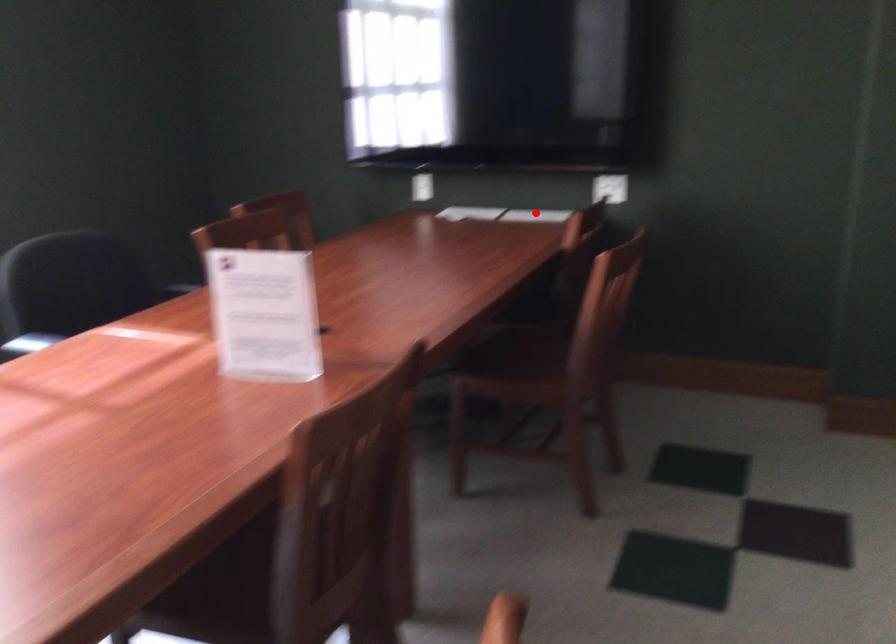
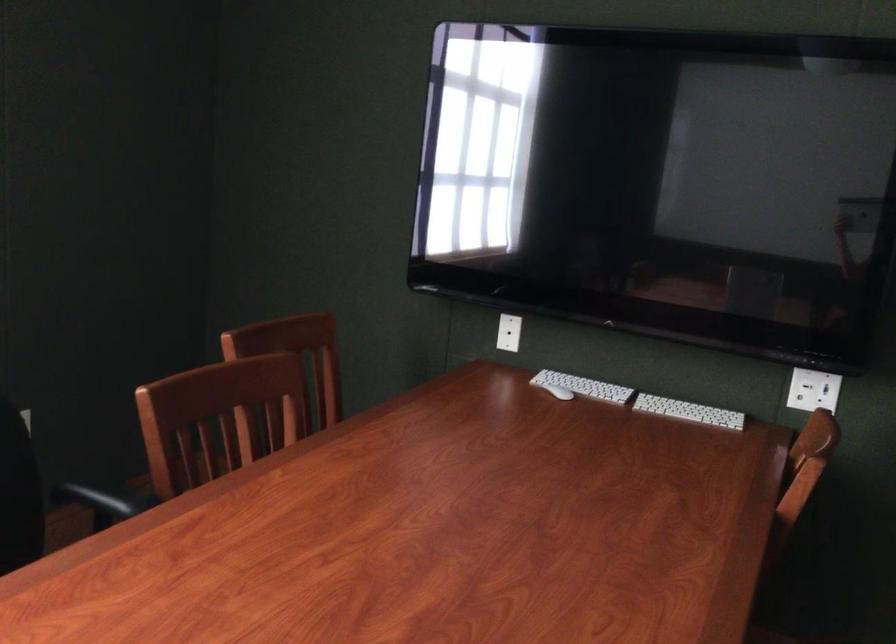
Question: I am providing you with two images of the same scene from different viewpoints. In image1, a red point is highlighted. Considering the same 3D point in image2, which of the following is correct?

Choices:
 (A) It is closer
 (B) It is farther

Answer: (A)